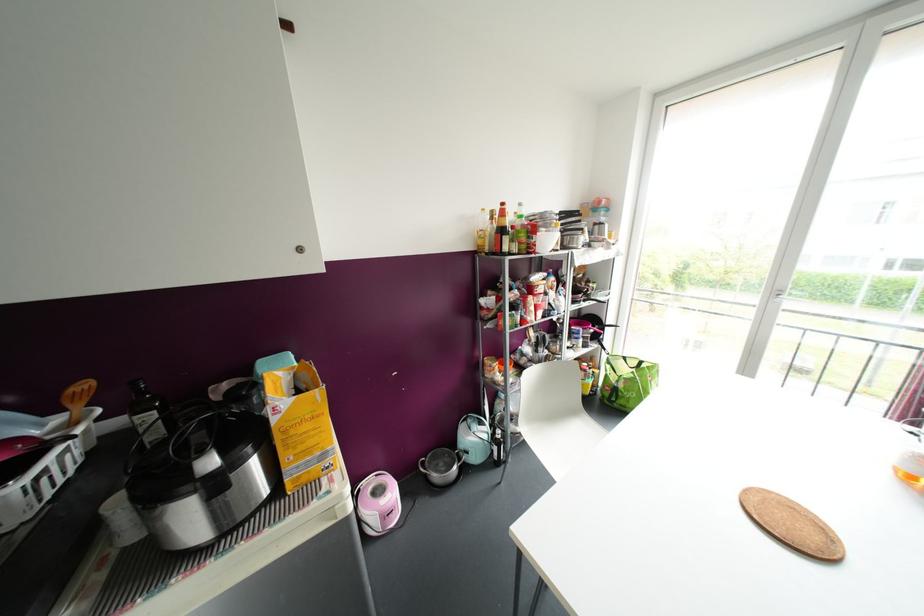
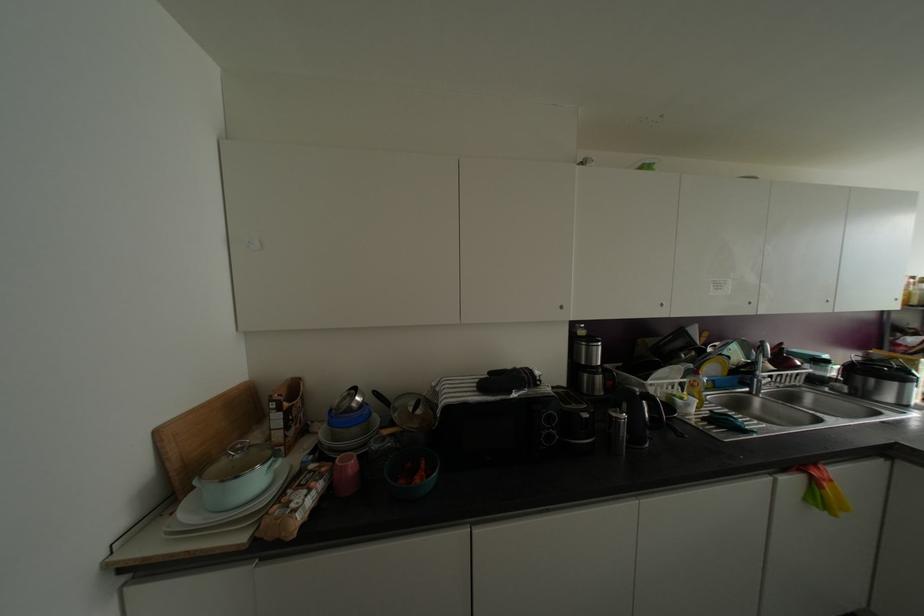
In a continuous first-person perspective shot, in which direction is the camera moving?

The cameraman moved toward left, backward.